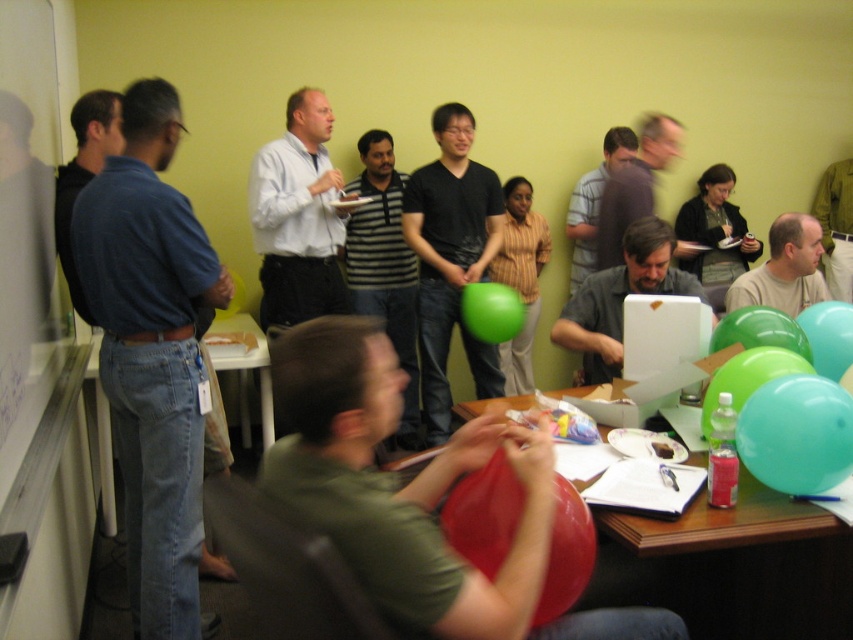
You are organizing a photo shoot and want to ensure that the matte gray shirt at center and the matte black shirt at center are visible in the final shot. Based on their positions, which of the two shirts should you focus on to ensure both are clearly visible?

The matte gray shirt at center is in front of the matte black shirt at center, so focusing on the matte gray shirt at center will ensure both are visible as it is closer to the camera.

You are organizing a photo shoot in the conference room and need to position two models wearing the matte gray shirt at center and the matte black shirt at center. According to the scene, which model should stand to the right to maintain the original spatial arrangement?

The matte black shirt at center should stand to the right because the matte gray shirt at center was originally to the left of the matte black shirt at center.